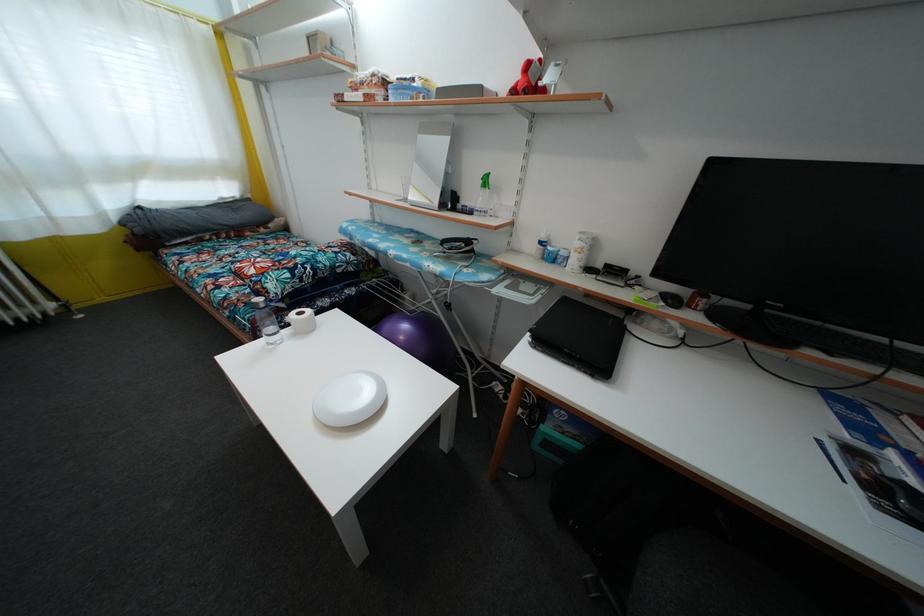
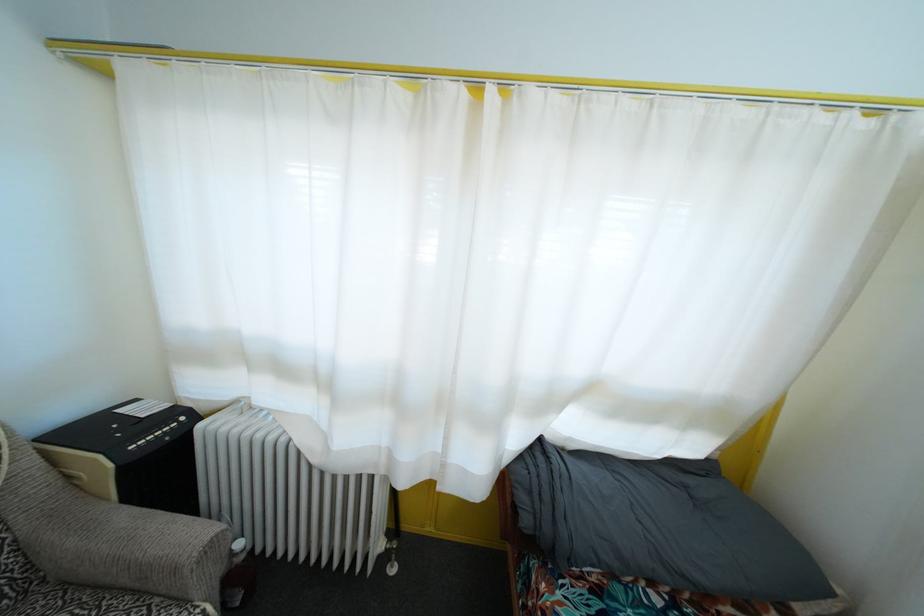
Find the pixel in the second image that matches [141,237] in the first image.

(529, 528)